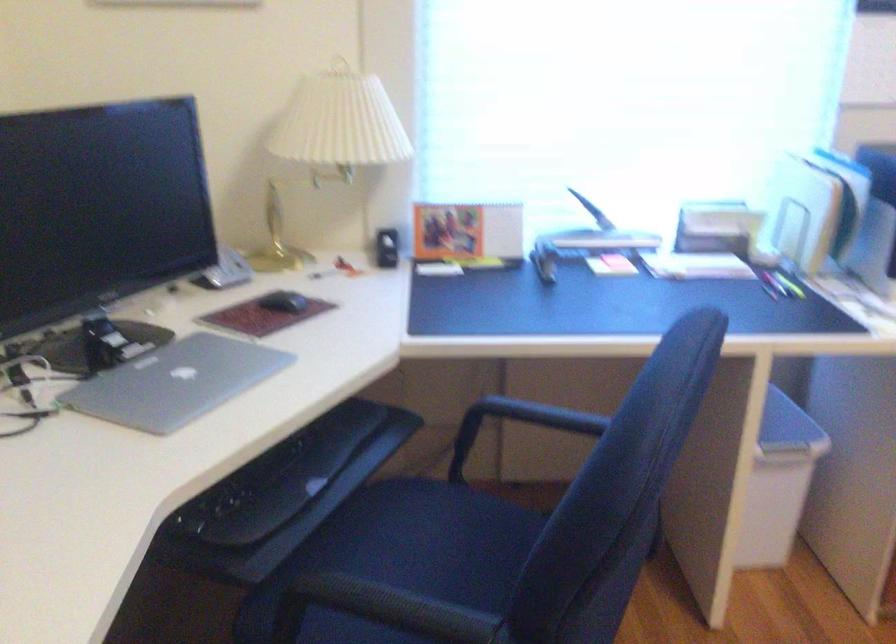
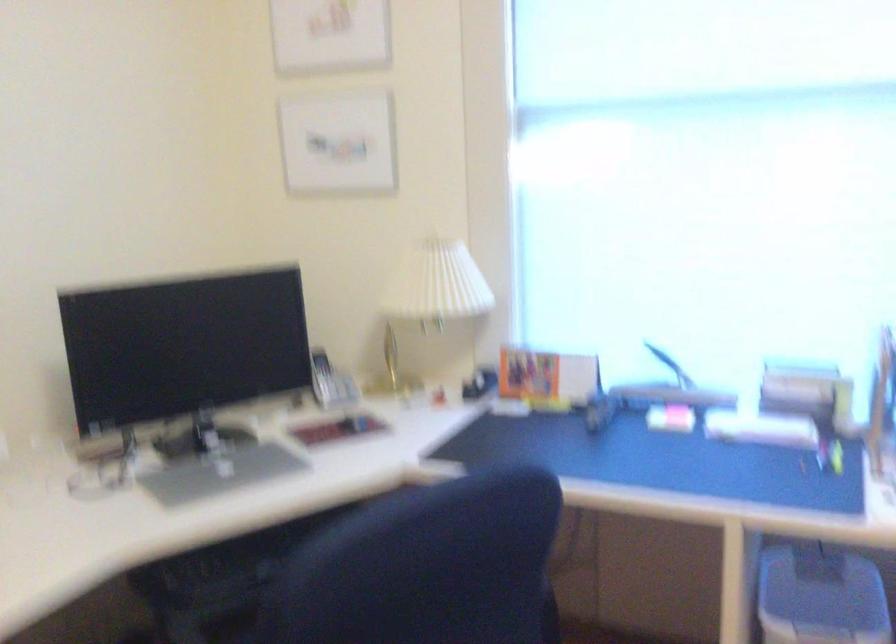
Question: How did the camera likely rotate?

Choices:
 (A) Left
 (B) Right
 (C) Up
 (D) Down

Answer: (A)